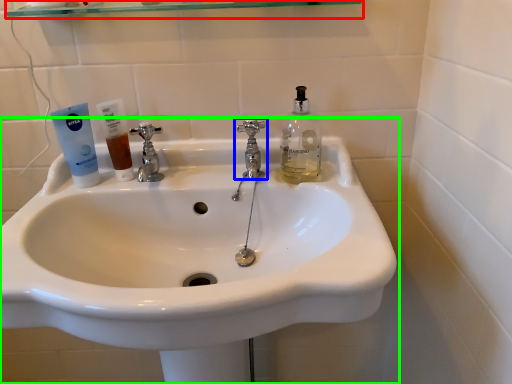
Question: Which is nearer to the shelf (highlighted by a red box)? tap (highlighted by a blue box) or sink (highlighted by a green box).

Choices:
 (A) tap
 (B) sink

Answer: (A)